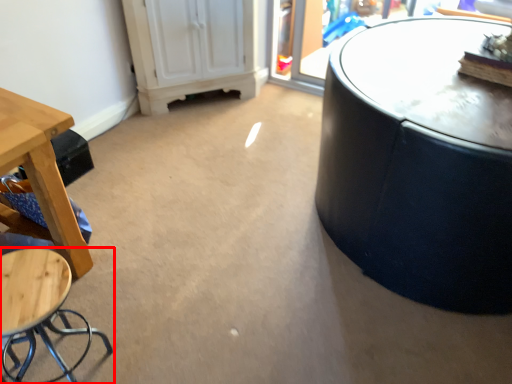
Question: Observing the image, what is the correct spatial positioning of stool (annotated by the red box) in reference to table?

Choices:
 (A) left
 (B) right

Answer: (B)